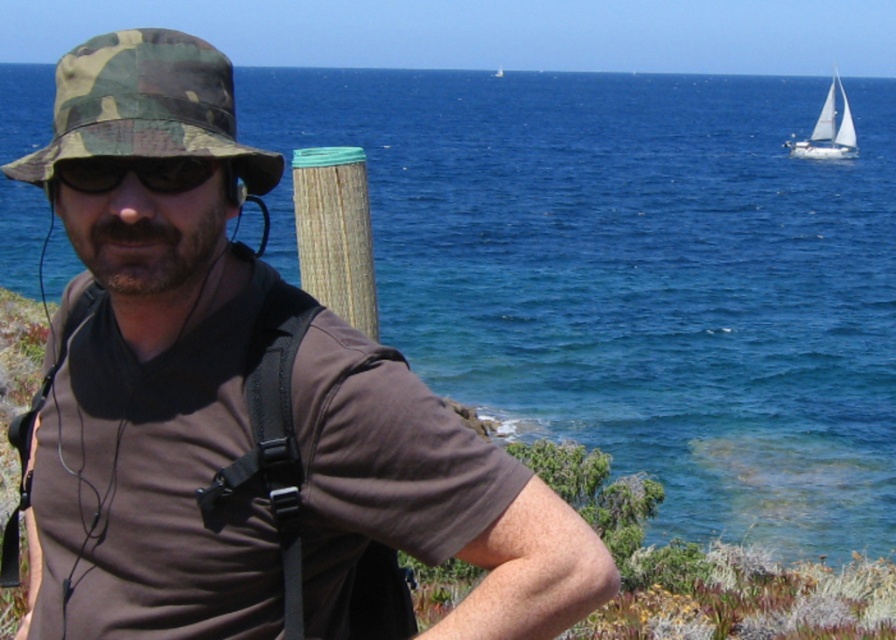
You are a photographer trying to capture the black matte sunglasses at center in the image. What are the coordinates where you should focus your camera?

The black matte sunglasses at center are located at coordinates point (134, 172).

You are analyzing the image of a person near a coastal area. The scene includes a camo fabric hat at upper left. Based on its coordinates, is the hat closer to the top or the left edge of the image?

The camo fabric hat at upper left is located at point coordinates that are both approximately 0.16, meaning it is equidistant from the top and left edges of the image.

You are a photographer trying to capture the person in the image. Since the brown matte shirt at center and the camo fabric hat at upper left are both visible, which object should you focus on to ensure the subject is properly framed?

You should focus on the camo fabric hat at upper left because it occupies more space in the image compared to the brown matte shirt at center, ensuring proper framing of the subject.